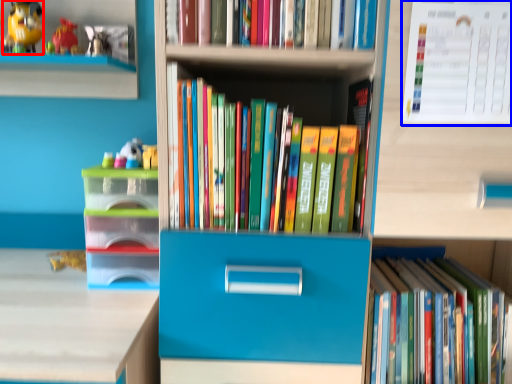
Question: Which point is closer to the camera, toy (highlighted by a red box) or paperback book (highlighted by a blue box)?

Choices:
 (A) toy
 (B) paperback book

Answer: (B)